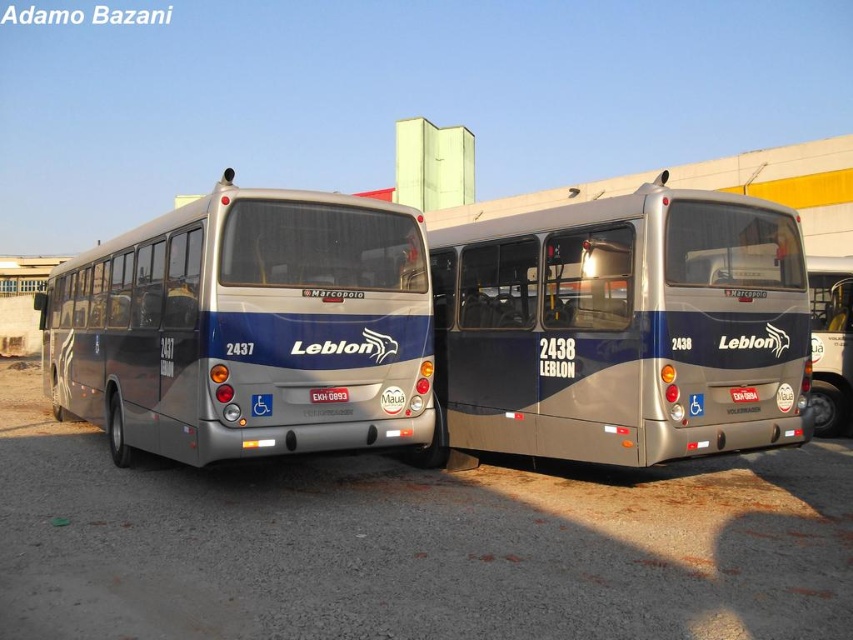
Does metallic silver bus at center appear under silver metallic bus at center?

No, metallic silver bus at center is not below silver metallic bus at center.

Does metallic silver bus at center have a greater width compared to silver metallic bus at center?

Yes, metallic silver bus at center is wider than silver metallic bus at center.

Identify the location of metallic silver bus at center. (624, 328).

Who is positioned more to the right, silver metallic bus at left or silver metallic bus at center?

silver metallic bus at center is more to the right.

Does silver metallic bus at left appear on the right side of silver metallic bus at center?

Incorrect, silver metallic bus at left is not on the right side of silver metallic bus at center.

The height and width of the screenshot is (640, 853). I want to click on silver metallic bus at left, so click(247, 328).

Does metallic silver bus at center appear over silver metallic bus at left?

Yes.

Locate an element on the screen. The height and width of the screenshot is (640, 853). metallic silver bus at center is located at coordinates (624, 328).